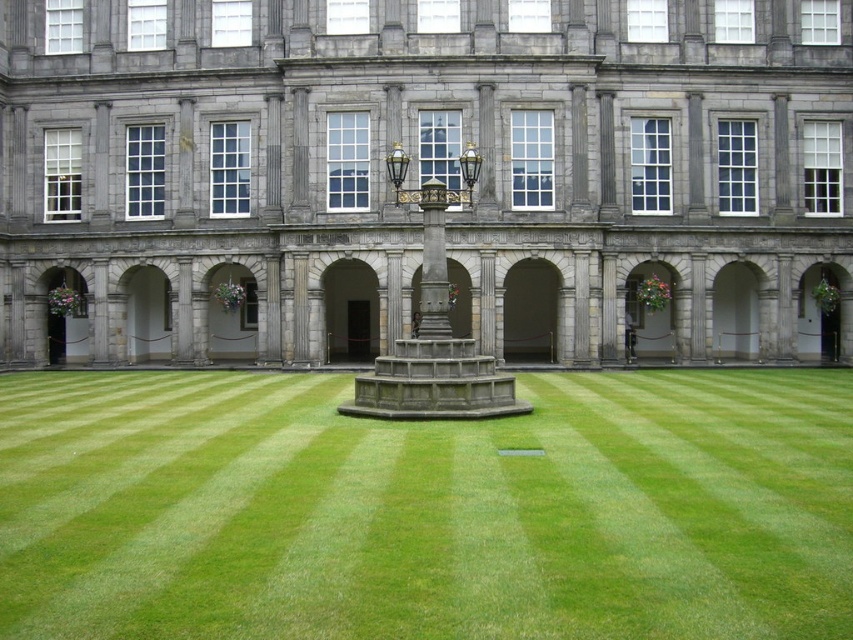
Question: Does gray stone building at center come behind green grass at center?

Choices:
 (A) yes
 (B) no

Answer: (A)

Question: Among these points, which one is nearest to the camera?

Choices:
 (A) (498, 600)
 (B) (311, 148)

Answer: (A)

Question: Is gray stone building at center to the left of green grass at center from the viewer's perspective?

Choices:
 (A) no
 (B) yes

Answer: (A)

Question: Which point is farther to the camera?

Choices:
 (A) gray stone building at center
 (B) green grass at center

Answer: (A)

Question: Does gray stone building at center have a larger size compared to green grass at center?

Choices:
 (A) no
 (B) yes

Answer: (B)